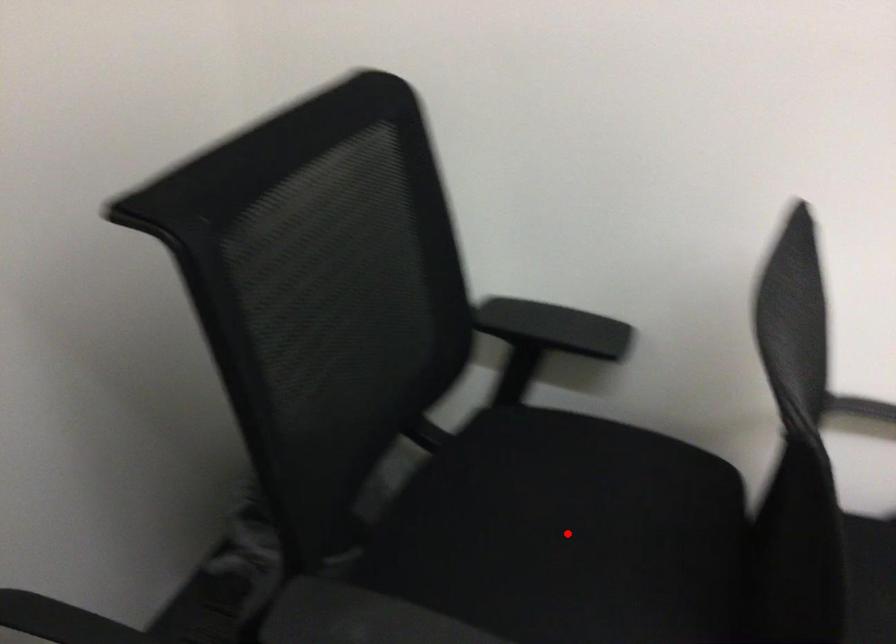
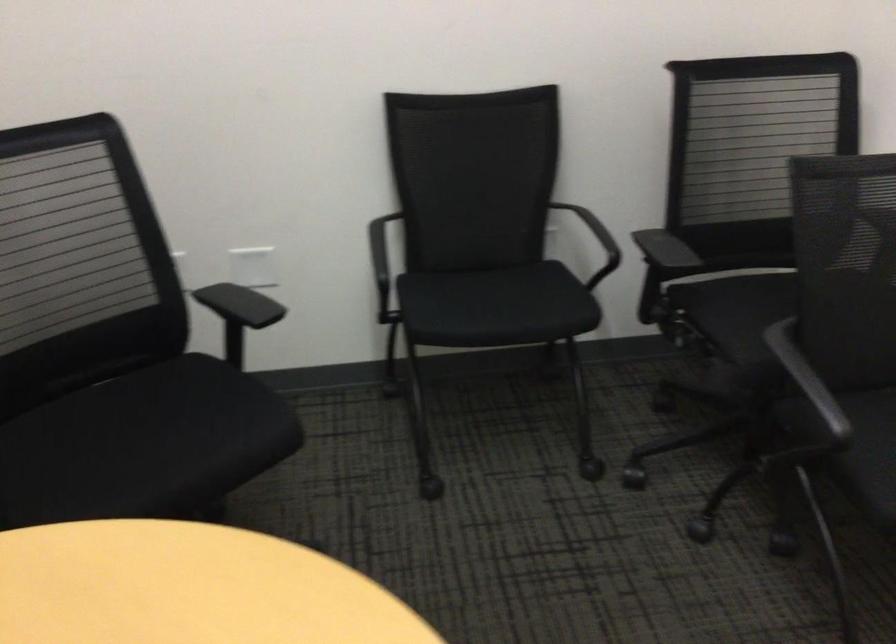
Question: I am providing you with two images of the same scene from different viewpoints. A red point is marked on the first image. Is the red point's position out of view in image 2?

Choices:
 (A) Yes
 (B) No

Answer: (A)